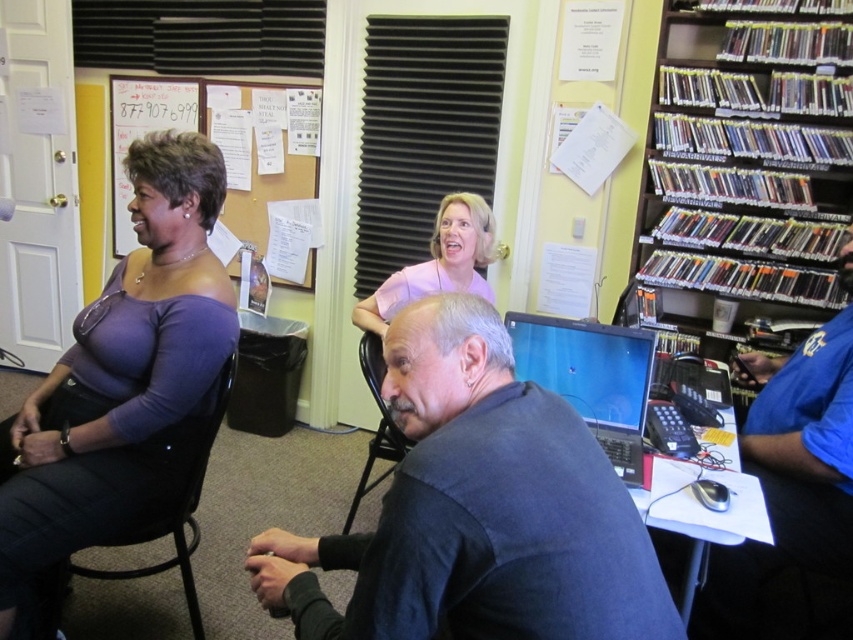
What do you see at coordinates (120, 374) in the screenshot? I see `purple matte top at left` at bounding box center [120, 374].

Is purple matte top at left taller than matte brown paper at upper left?

Indeed, purple matte top at left has a greater height compared to matte brown paper at upper left.

Is point (219, 356) in front of point (263, 248)?

Yes, point (219, 356) is closer to viewer.

This screenshot has height=640, width=853. I want to click on purple matte top at left, so click(120, 374).

Can you confirm if pink matte blouse at upper center is shorter than black fabric chair at left?

Indeed, pink matte blouse at upper center has a lesser height compared to black fabric chair at left.

Is point (433, 280) behind point (115, 573)?

That is True.

The image size is (853, 640). Find the location of `pink matte blouse at upper center`. pink matte blouse at upper center is located at coordinates (438, 262).

Can you confirm if purple matte top at left is bigger than black fabric chair at left?

Actually, purple matte top at left might be smaller than black fabric chair at left.

Can you confirm if purple matte top at left is positioned below black fabric chair at left?

No.

Is point (6, 458) closer to viewer compared to point (234, 376)?

Yes, it is in front of point (234, 376).

Where is `purple matte top at left`? Image resolution: width=853 pixels, height=640 pixels. purple matte top at left is located at coordinates (120, 374).